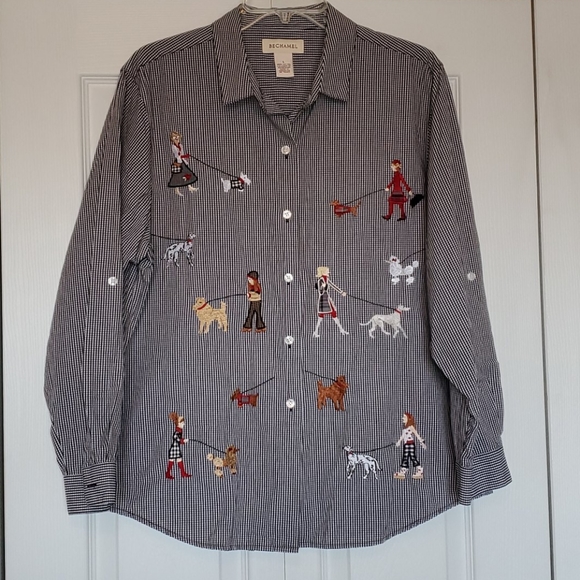
Where is `artwork lower middle right`? This screenshot has height=580, width=580. artwork lower middle right is located at coordinates (327, 296).